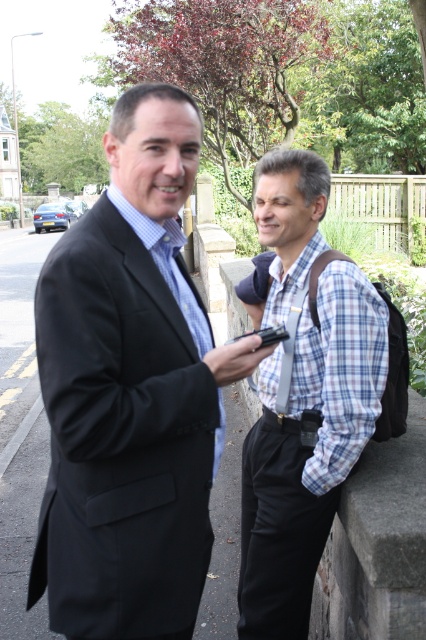
Can you confirm if black suit at left is smaller than plaid fabric shirt at center?

Actually, black suit at left might be larger than plaid fabric shirt at center.

Which is behind, point (85, 465) or point (290, 627)?

Point (290, 627)

Who is more forward, (74, 465) or (298, 465)?

Point (74, 465) is in front.

At what (x,y) coordinates should I click in order to perform the action: click on black suit at left. Please return your answer as a coordinate pair (x, y). The height and width of the screenshot is (640, 426). Looking at the image, I should click on (131, 392).